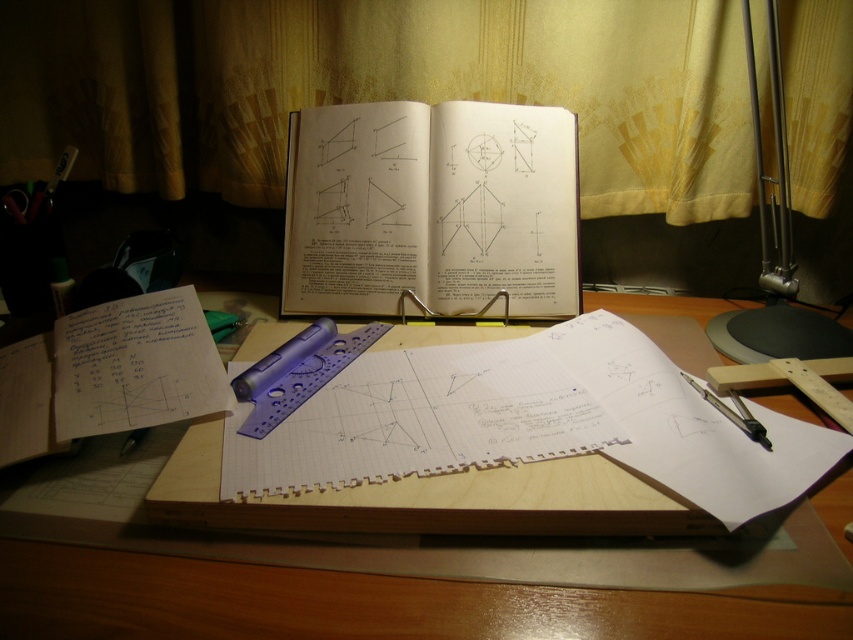
Based on the photo, you are organizing your desk and need to place a new item between the wooden desk at center and the metallic silver compass at lower right. Based on their positions, where should you place the new item?

The wooden desk at center is positioned on the left side of the metallic silver compass at lower right, so you should place the new item between them to the right of the wooden desk at center and to the left of the metallic silver compass at lower right.